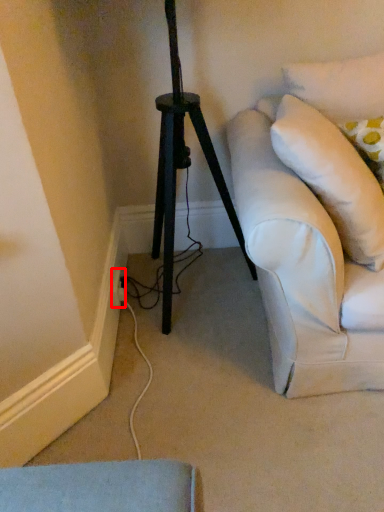
Question: From the image's perspective, where is electric outlet (annotated by the red box) located in relation to pillow in the image?

Choices:
 (A) above
 (B) below

Answer: (B)